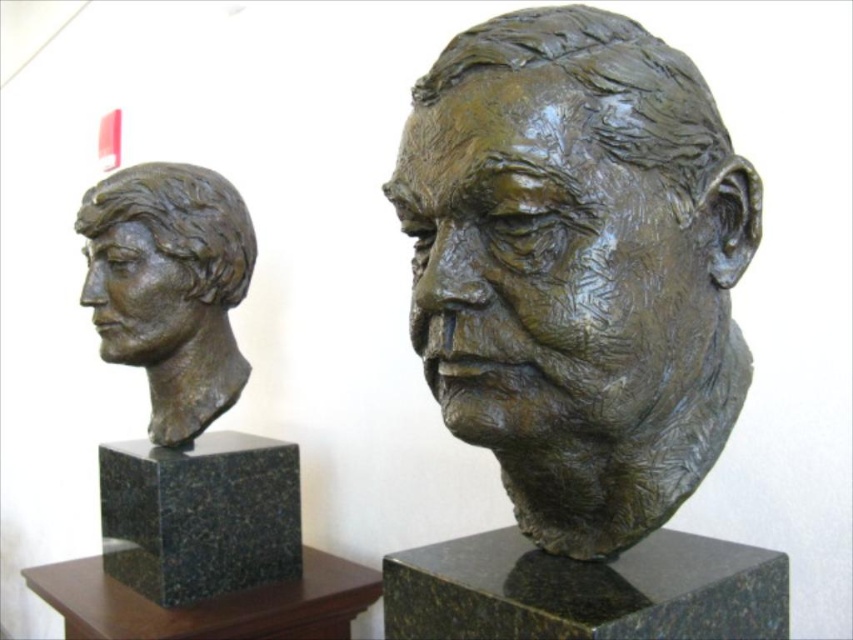
Question: Does bronze bust at left appear on the right side of matte bronze head at left?

Choices:
 (A) no
 (B) yes

Answer: (B)

Question: Does bronze bust at left appear on the right side of matte bronze head at left?

Choices:
 (A) no
 (B) yes

Answer: (B)

Question: Among these points, which one is farthest from the camera?

Choices:
 (A) (173, 186)
 (B) (642, 468)
 (C) (225, 264)

Answer: (C)

Question: Which object is the closest to the matte bronze head at left?

Choices:
 (A) bronze sculpture at center
 (B) bronze bust at left

Answer: (B)

Question: Does bronze sculpture at center come in front of bronze bust at left?

Choices:
 (A) no
 (B) yes

Answer: (B)

Question: Considering the real-world distances, which object is closest to the matte bronze head at left?

Choices:
 (A) bronze bust at left
 (B) bronze sculpture at center

Answer: (A)